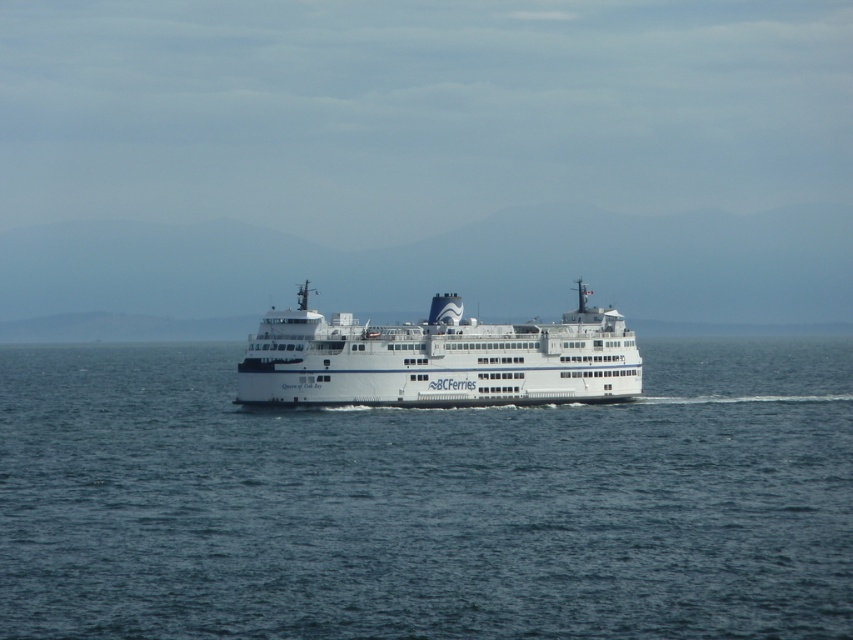
Question: Which point is farther to the camera?

Choices:
 (A) (132, 497)
 (B) (431, 344)

Answer: (B)

Question: Is the position of blue water at center more distant than that of white matte ferry at center?

Choices:
 (A) no
 (B) yes

Answer: (A)

Question: Can you confirm if blue water at center is positioned to the right of white matte ferry at center?

Choices:
 (A) no
 (B) yes

Answer: (A)

Question: Which point is farther to the camera?

Choices:
 (A) blue water at center
 (B) white matte ferry at center

Answer: (B)

Question: Which point is farther to the camera?

Choices:
 (A) blue water at center
 (B) white matte ferry at center

Answer: (B)

Question: Does blue water at center appear over white matte ferry at center?

Choices:
 (A) yes
 (B) no

Answer: (B)